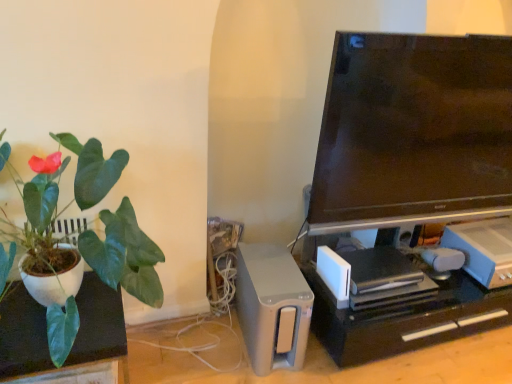
The height and width of the screenshot is (384, 512). What are the coordinates of `vacant region above white matte plant pot at left (from a real-world perspective)` in the screenshot? It's located at (44, 317).